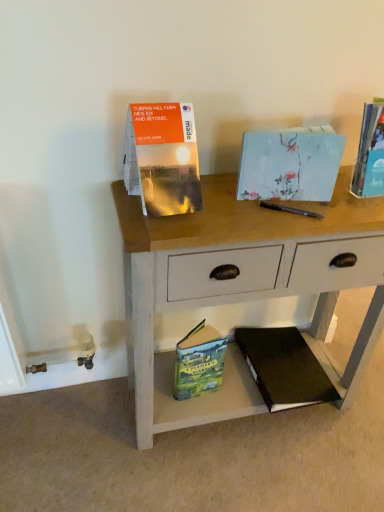
The width and height of the screenshot is (384, 512). Find the location of `free area in between wooden desk at center and black hardcover book at lower right, arranged as the 1th paperback book when ordered from the bottom`. free area in between wooden desk at center and black hardcover book at lower right, arranged as the 1th paperback book when ordered from the bottom is located at coordinates (244, 435).